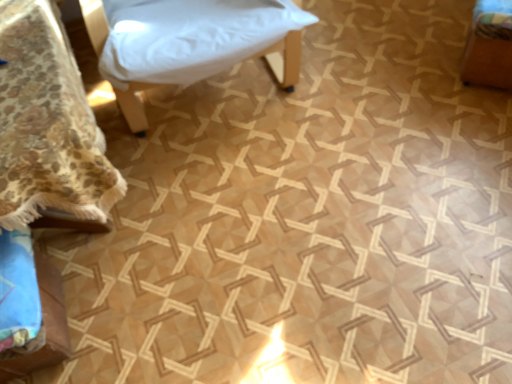
Locate an element on the screen. The width and height of the screenshot is (512, 384). free space between blue fabric cushion at lower left, which is the 2th furniture from left to right, and floral fabric bedspread at lower left, which ranks as the first furniture in left-to-right order is located at coordinates (120, 316).